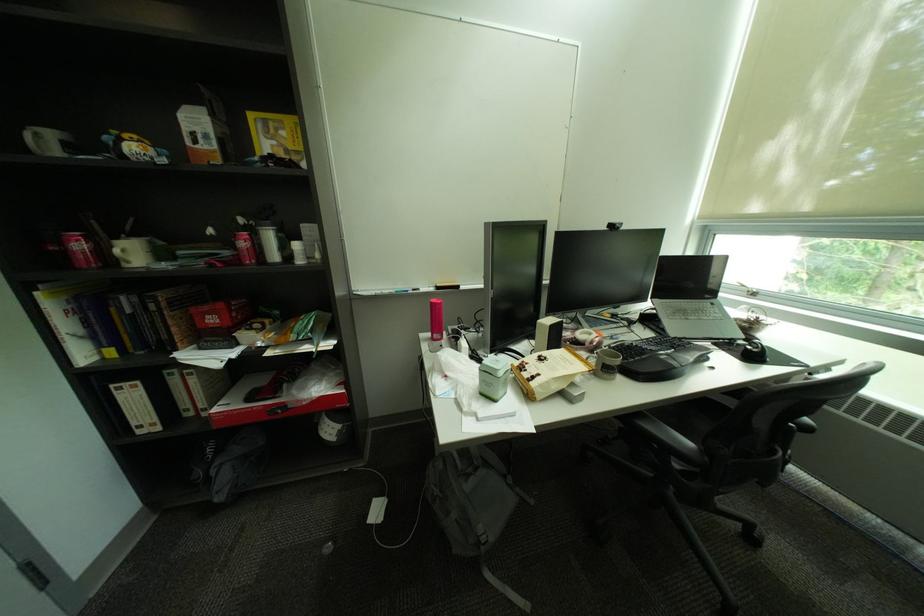
The image size is (924, 616). Describe the element at coordinates (678, 429) in the screenshot. I see `the chair sitting surface` at that location.